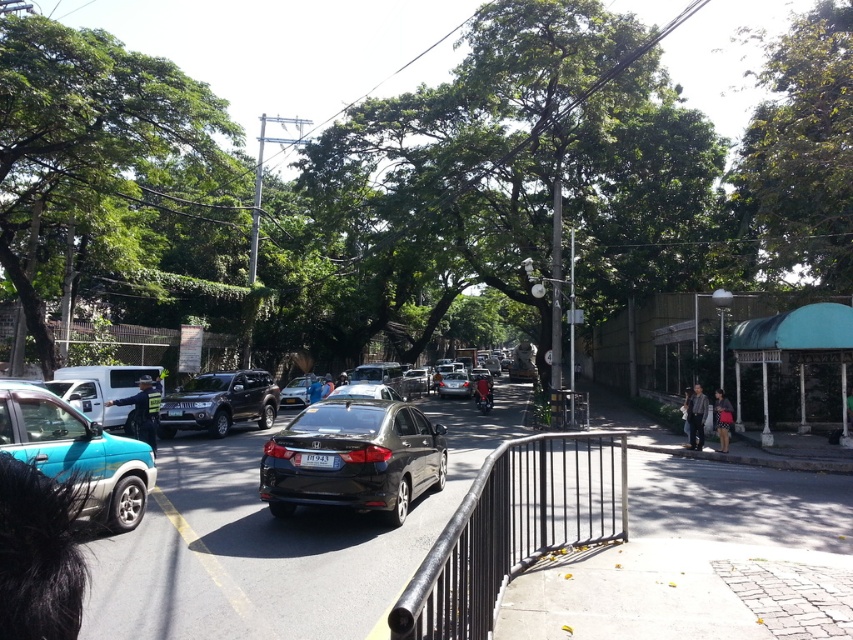
You are a photographer standing on the sidewalk and want to take a photo of the satin black sedan at center without including the dark blue shirt at center in the frame. Is this possible given their positions?

The satin black sedan at center is positioned under dark blue shirt at center, so the shirt is blocking the direct line of sight to the sedan. Therefore, the photographer cannot take a photo of the satin black sedan at center without including the dark blue shirt at center in the frame.

You are a photographer standing on the sidewalk near the black metal railing. You want to capture a photo that includes both the green leafy tree at upper right and the dark gray shirt at lower right. Which object will appear larger in the photo?

The green leafy tree at upper right will appear larger in the photo because it has a greater height compared to the dark gray shirt at lower right.

You are a delivery person trying to locate a package left at point coordinates [695,417]. What object is located at that point?

The dark gray shirt at lower right is located at point coordinates [695,417].